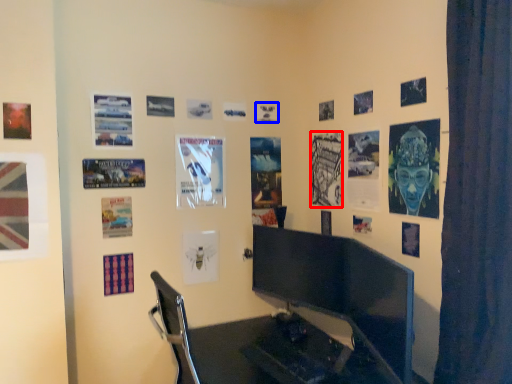
Question: Which object is further to the camera taking this photo, poster page (highlighted by a red box) or poster page (highlighted by a blue box)?

Choices:
 (A) poster page
 (B) poster page

Answer: (B)